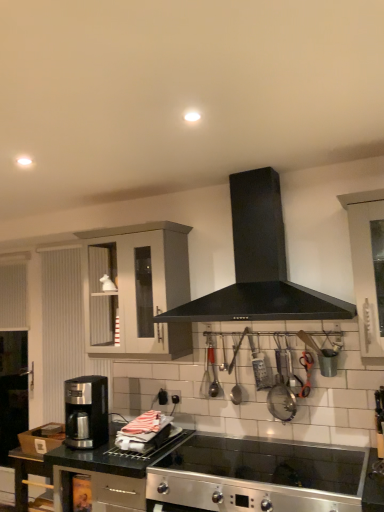
This screenshot has height=512, width=384. What do you see at coordinates (249, 477) in the screenshot? I see `stainless steel cooktop at lower center, which is counted as the 1th countertop, starting from the right` at bounding box center [249, 477].

Identify the location of black granite countertop at lower left, the 1th countertop positioned from the left. Image resolution: width=384 pixels, height=512 pixels. (105, 474).

In the scene shown: How distant is stainless steel cooktop at lower center, the 2th countertop from the left, from matte gray cabinet at upper left?

stainless steel cooktop at lower center, the 2th countertop from the left, is 34.55 inches away from matte gray cabinet at upper left.

Is point (220, 486) in front of point (107, 241)?

Yes, point (220, 486) is closer to viewer.

Which object is closer to the camera, stainless steel cooktop at lower center, the 2th countertop from the left, or matte gray cabinet at upper left?

stainless steel cooktop at lower center, the 2th countertop from the left, is closer to the camera.

Is metallic silver strainer at center-right next to stainless steel cooktop at lower center, which is counted as the 1th countertop, starting from the right?

metallic silver strainer at center-right and stainless steel cooktop at lower center, which is counted as the 1th countertop, starting from the right, are clearly separated.

Considering the positions of objects metallic silver strainer at center-right and stainless steel cooktop at lower center, which is counted as the 1th countertop, starting from the right, in the image provided, who is more to the left, metallic silver strainer at center-right or stainless steel cooktop at lower center, which is counted as the 1th countertop, starting from the right,?

Positioned to the left is stainless steel cooktop at lower center, which is counted as the 1th countertop, starting from the right.

Looking at this image, is metallic silver strainer at center-right situated inside stainless steel cooktop at lower center, which is counted as the 1th countertop, starting from the right, or outside?

metallic silver strainer at center-right is not enclosed by stainless steel cooktop at lower center, which is counted as the 1th countertop, starting from the right.

Would you say satin black coffee maker at lower left is inside or outside black granite countertop at lower left, the 1th countertop positioned from the left?

satin black coffee maker at lower left is spatially situated outside black granite countertop at lower left, the 1th countertop positioned from the left.

Identify the location of coffee maker that appears behind the black granite countertop at lower left, which ranks as the second countertop in right-to-left order. (86, 412).

Does satin black coffee maker at lower left have a greater height compared to black granite countertop at lower left, the 1th countertop positioned from the left?

In fact, satin black coffee maker at lower left may be shorter than black granite countertop at lower left, the 1th countertop positioned from the left.

Is point (73, 439) behind point (59, 473)?

Yes, it is behind point (59, 473).

Is satin black coffee maker at lower left to the left of metallic silver strainer at center-right from the viewer's perspective?

Indeed, satin black coffee maker at lower left is positioned on the left side of metallic silver strainer at center-right.

From the image's perspective, is satin black coffee maker at lower left beneath metallic silver strainer at center-right?

Yes, from the image's perspective, satin black coffee maker at lower left is beneath metallic silver strainer at center-right.

Looking at this image, is satin black coffee maker at lower left with metallic silver strainer at center-right?

There is a gap between satin black coffee maker at lower left and metallic silver strainer at center-right.

From a real-world perspective, is satin black coffee maker at lower left above or below metallic silver strainer at center-right?

Clearly, from a real-world perspective, satin black coffee maker at lower left is below metallic silver strainer at center-right.

You are a GUI agent. You are given a task and a screenshot of the screen. Output one action in this format:
    pyautogui.click(x=<x>, y=<y>)
    Task: Click on the countertop that is in front of the black granite countertop at lower left, which ranks as the second countertop in right-to-left order
    The height and width of the screenshot is (512, 384).
    Given the screenshot: What is the action you would take?
    click(249, 477)

Which object is closer to the camera taking this photo, black granite countertop at lower left, which ranks as the second countertop in right-to-left order, or stainless steel cooktop at lower center, which is counted as the 1th countertop, starting from the right?

Positioned in front is stainless steel cooktop at lower center, which is counted as the 1th countertop, starting from the right.

Which is more to the right, black granite countertop at lower left, which ranks as the second countertop in right-to-left order, or stainless steel cooktop at lower center, the 2th countertop from the left?

stainless steel cooktop at lower center, the 2th countertop from the left.

Is black granite countertop at lower left, the 1th countertop positioned from the left, looking in the opposite direction of stainless steel cooktop at lower center, the 2th countertop from the left?

That's not correct — black granite countertop at lower left, the 1th countertop positioned from the left, is not looking away from stainless steel cooktop at lower center, the 2th countertop from the left.

Would you say metallic silver strainer at center-right is part of black granite countertop at lower left, the 1th countertop positioned from the left,'s contents?

Actually, metallic silver strainer at center-right is outside black granite countertop at lower left, the 1th countertop positioned from the left.

Are black granite countertop at lower left, which ranks as the second countertop in right-to-left order, and metallic silver strainer at center-right located far from each other?

No, there isn't a large distance between black granite countertop at lower left, which ranks as the second countertop in right-to-left order, and metallic silver strainer at center-right.

Does black granite countertop at lower left, which ranks as the second countertop in right-to-left order, have a larger size compared to metallic silver strainer at center-right?

Indeed, black granite countertop at lower left, which ranks as the second countertop in right-to-left order, has a larger size compared to metallic silver strainer at center-right.

The width and height of the screenshot is (384, 512). Find the location of `appliance on the right of black granite countertop at lower left, which ranks as the second countertop in right-to-left order`. appliance on the right of black granite countertop at lower left, which ranks as the second countertop in right-to-left order is located at coordinates (281, 401).

Is satin black coffee maker at lower left surrounded by metallic silver strainer at center-right?

No, satin black coffee maker at lower left is not inside metallic silver strainer at center-right.

Is metallic silver strainer at center-right oriented away from satin black coffee maker at lower left?

No.

Does metallic silver strainer at center-right have a smaller size compared to satin black coffee maker at lower left?

Yes, metallic silver strainer at center-right is smaller than satin black coffee maker at lower left.

Considering the relative sizes of metallic silver strainer at center-right and satin black coffee maker at lower left in the image provided, is metallic silver strainer at center-right thinner than satin black coffee maker at lower left?

Correct, the width of metallic silver strainer at center-right is less than that of satin black coffee maker at lower left.

Locate an element on the screen. This screenshot has width=384, height=512. cabinetry that is behind the stainless steel cooktop at lower center, the 2th countertop from the left is located at coordinates (144, 287).

Locate an element on the screen. Image resolution: width=384 pixels, height=512 pixels. appliance above the stainless steel cooktop at lower center, the 2th countertop from the left (from the image's perspective) is located at coordinates (281, 401).

Estimate the real-world distances between objects in this image. Which object is closer to metallic silver strainer at center-right, satin black coffee maker at lower left or stainless steel cooktop at lower center, which is counted as the 1th countertop, starting from the right?

stainless steel cooktop at lower center, which is counted as the 1th countertop, starting from the right, is closer to metallic silver strainer at center-right.

Which object lies further to the anchor point black matte range hood at center, stainless steel cooktop at lower center, which is counted as the 1th countertop, starting from the right, or black granite countertop at lower left, the 1th countertop positioned from the left?

black granite countertop at lower left, the 1th countertop positioned from the left, lies further to black matte range hood at center than the other object.

Which object lies further to the anchor point black matte range hood at center, satin black coffee maker at lower left or metallic silver strainer at center-right?

satin black coffee maker at lower left is positioned further to the anchor black matte range hood at center.

Looking at this image, based on their spatial positions, is matte gray cabinet at upper left or black granite countertop at lower left, the 1th countertop positioned from the left, closer to satin black coffee maker at lower left?

Among the two, black granite countertop at lower left, the 1th countertop positioned from the left, is located nearer to satin black coffee maker at lower left.

Looking at the image, which one is located closer to black granite countertop at lower left, which ranks as the second countertop in right-to-left order, metallic silver strainer at center-right or stainless steel cooktop at lower center, which is counted as the 1th countertop, starting from the right?

The object closer to black granite countertop at lower left, which ranks as the second countertop in right-to-left order, is stainless steel cooktop at lower center, which is counted as the 1th countertop, starting from the right.

From the image, which object appears to be farther from satin black coffee maker at lower left, black matte range hood at center or black granite countertop at lower left, which ranks as the second countertop in right-to-left order?

black matte range hood at center lies further to satin black coffee maker at lower left than the other object.

Considering their positions, is stainless steel cooktop at lower center, the 2th countertop from the left, positioned closer to satin black coffee maker at lower left than metallic silver strainer at center-right?

stainless steel cooktop at lower center, the 2th countertop from the left.

Based on their spatial positions, is stainless steel cooktop at lower center, the 2th countertop from the left, or metallic silver strainer at center-right further from black granite countertop at lower left, which ranks as the second countertop in right-to-left order?

metallic silver strainer at center-right is positioned further to the anchor black granite countertop at lower left, which ranks as the second countertop in right-to-left order.

Locate an element on the screen. The height and width of the screenshot is (512, 384). cabinetry between satin black coffee maker at lower left and stainless steel cooktop at lower center, which is counted as the 1th countertop, starting from the right, from left to right is located at coordinates (144, 287).

Identify the location of coffee maker between black matte range hood at center and stainless steel cooktop at lower center, which is counted as the 1th countertop, starting from the right, from top to bottom. This screenshot has height=512, width=384. (86, 412).

Where is `countertop located between satin black coffee maker at lower left and stainless steel cooktop at lower center, the 2th countertop from the left, in the left-right direction`? countertop located between satin black coffee maker at lower left and stainless steel cooktop at lower center, the 2th countertop from the left, in the left-right direction is located at coordinates (105, 474).

Locate an element on the screen. countertop between matte gray cabinet at upper left and black granite countertop at lower left, which ranks as the second countertop in right-to-left order, from top to bottom is located at coordinates (249, 477).